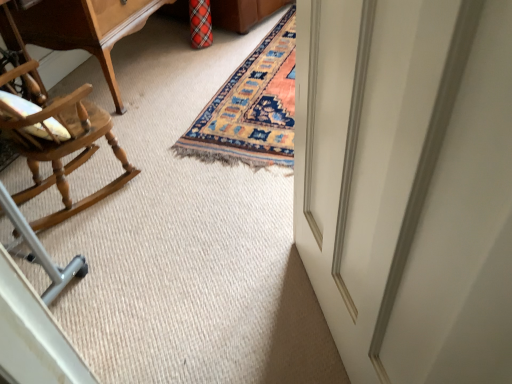
Question: Considering the relative sizes of white glossy door at right and light brown wood rocking chair at left in the image provided, is white glossy door at right bigger than light brown wood rocking chair at left?

Choices:
 (A) no
 (B) yes

Answer: (A)

Question: Is white glossy door at right thinner than light brown wood rocking chair at left?

Choices:
 (A) no
 (B) yes

Answer: (B)

Question: Considering the relative positions of white glossy door at right and light brown wood rocking chair at left in the image provided, is white glossy door at right to the right of light brown wood rocking chair at left from the viewer's perspective?

Choices:
 (A) no
 (B) yes

Answer: (B)

Question: From the image's perspective, is white glossy door at right over light brown wood rocking chair at left?

Choices:
 (A) yes
 (B) no

Answer: (B)

Question: Is light brown wood rocking chair at left located within white glossy door at right?

Choices:
 (A) yes
 (B) no

Answer: (B)

Question: Does white glossy door at right lie in front of light brown wood rocking chair at left?

Choices:
 (A) yes
 (B) no

Answer: (A)

Question: Considering the relative sizes of wooden table at upper left and white glossy door at right in the image provided, is wooden table at upper left smaller than white glossy door at right?

Choices:
 (A) yes
 (B) no

Answer: (B)

Question: Can you see wooden table at upper left touching white glossy door at right?

Choices:
 (A) no
 (B) yes

Answer: (A)

Question: Would you say wooden table at upper left contains white glossy door at right?

Choices:
 (A) yes
 (B) no

Answer: (B)

Question: Is wooden table at upper left positioned before white glossy door at right?

Choices:
 (A) yes
 (B) no

Answer: (B)

Question: Can you confirm if wooden table at upper left is taller than white glossy door at right?

Choices:
 (A) yes
 (B) no

Answer: (B)

Question: From the image's perspective, would you say wooden table at upper left is positioned over white glossy door at right?

Choices:
 (A) yes
 (B) no

Answer: (A)

Question: From the image's perspective, does wooden table at upper left appear lower than light brown wood rocking chair at left?

Choices:
 (A) no
 (B) yes

Answer: (A)